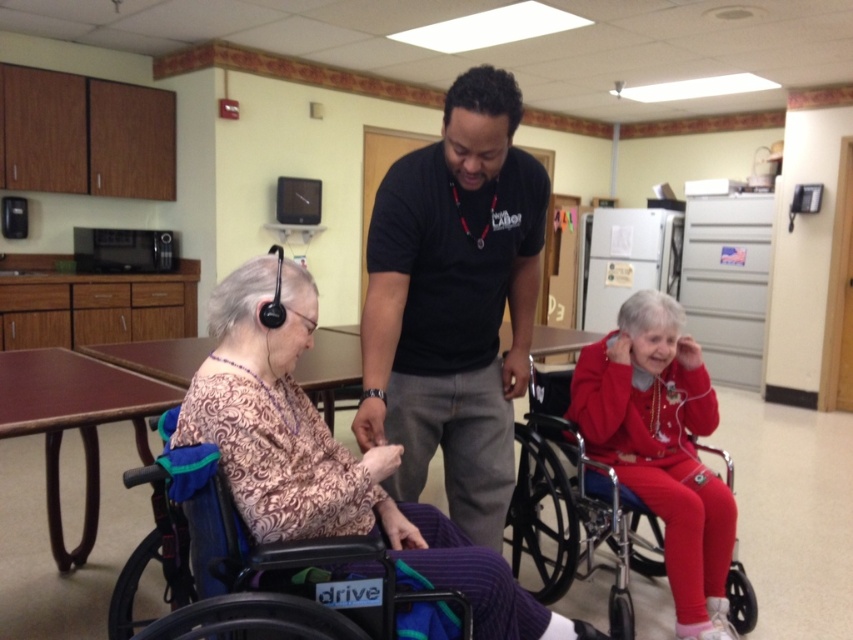
The height and width of the screenshot is (640, 853). Identify the location of patterned fabric wheelchair at left. (326, 456).

Can you confirm if metallic silver wheelchair at lower right is thinner than black plastic wheelchair at lower left?

Yes, metallic silver wheelchair at lower right is thinner than black plastic wheelchair at lower left.

Is point (631, 564) closer to viewer compared to point (109, 600)?

That is False.

Does point (505, 531) come closer to viewer compared to point (242, 552)?

No, (505, 531) is behind (242, 552).

The height and width of the screenshot is (640, 853). Find the location of `metallic silver wheelchair at lower right`. metallic silver wheelchair at lower right is located at coordinates (572, 506).

Which is more to the left, black cotton shirt at center or patterned fabric wheelchair at left?

patterned fabric wheelchair at left

Can you confirm if black cotton shirt at center is smaller than patterned fabric wheelchair at left?

Indeed, black cotton shirt at center has a smaller size compared to patterned fabric wheelchair at left.

Is point (381, 202) behind point (274, 296)?

Yes, it is.

This screenshot has width=853, height=640. I want to click on black cotton shirt at center, so click(x=454, y=301).